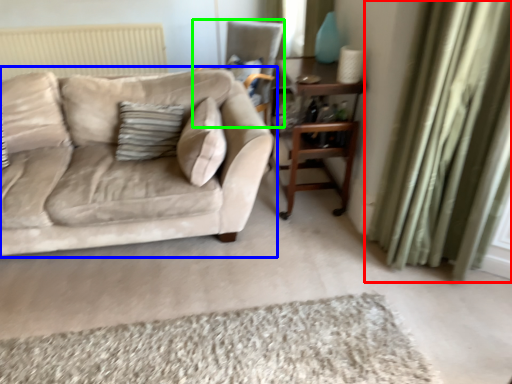
Question: Which is farther away from curtain (highlighted by a red box)? studio couch (highlighted by a blue box) or chair (highlighted by a green box)?

Choices:
 (A) studio couch
 (B) chair

Answer: (B)